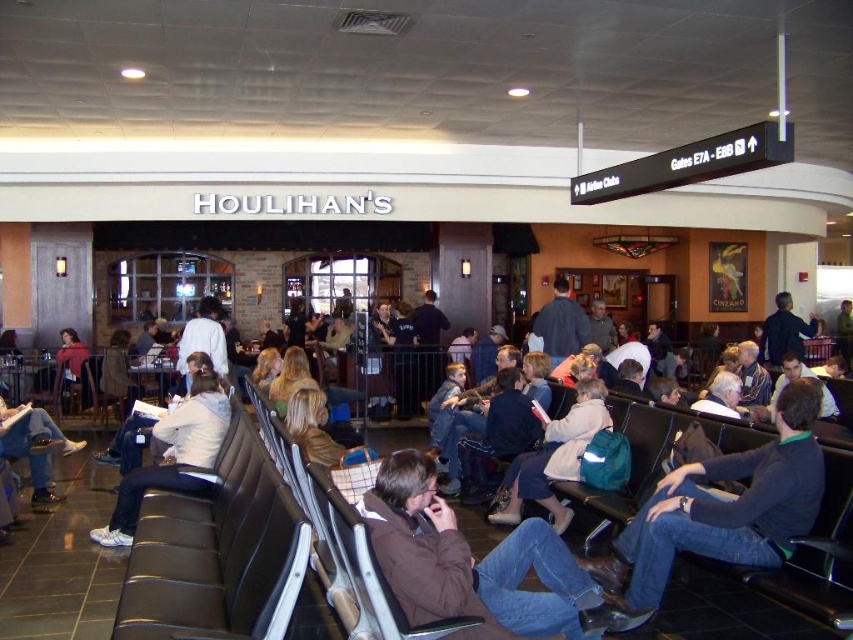
You are a traveler who just entered the airport waiting area. You see a black leather seat at center and a white fabric jacket at center. Which object is shorter?

The black leather seat at center is not as tall as the white fabric jacket at center, so the black leather seat at center is shorter.

You are a traveler looking for your jacket in the busy airport waiting area. You remember leaving a dark brown leather jacket at center and a denim jacket at lower left. Which jacket is closer to the directional sign indicating Gates E7A E8B?

The dark brown leather jacket at center is to the right of denim jacket at lower left. Since the directional sign is above the area, the dark brown leather jacket at center is closer to the sign as it is positioned centrally under it.

You are a traveler who just arrived in the waiting area and want to sit down. You see a black leather seat at center and a dark brown leather jacket at center. Which object is closer to you?

The black leather seat at center is closer to you because it is in front of the dark brown leather jacket at center.